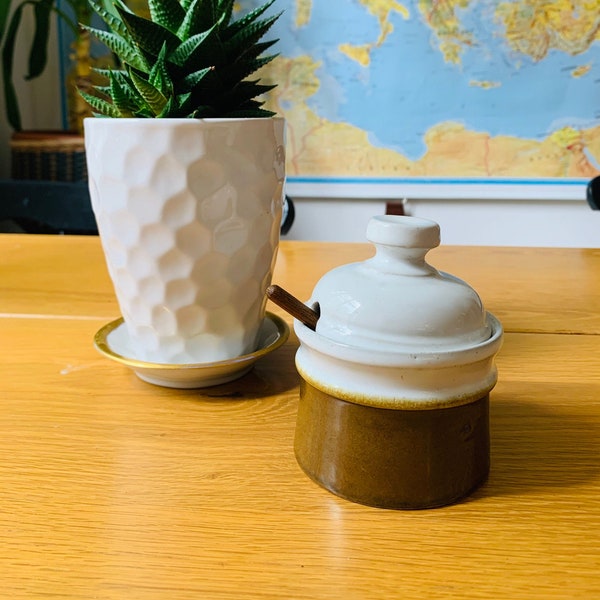
You are a GUI agent. You are given a task and a screenshot of the screen. Output one action in this format:
    pyautogui.click(x=<x>, y=<y>)
    Task: Click on the wicker basket
    This screenshot has width=600, height=600.
    Given the screenshot: What is the action you would take?
    (x=55, y=175)